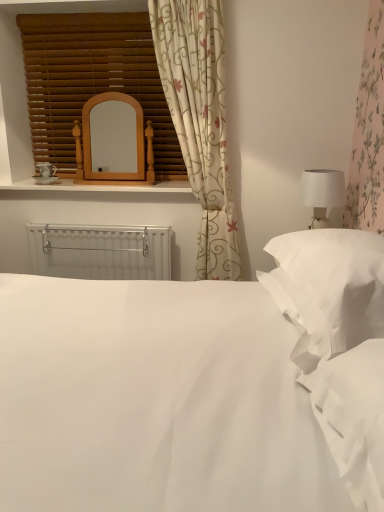
Question: Could you tell me if white soft pillow at right is turned towards white matte table lamp at right?

Choices:
 (A) no
 (B) yes

Answer: (A)

Question: Does white soft pillow at right contain white matte table lamp at right?

Choices:
 (A) yes
 (B) no

Answer: (B)

Question: Is white soft pillow at right thinner than white matte table lamp at right?

Choices:
 (A) yes
 (B) no

Answer: (B)

Question: Can you confirm if white soft pillow at right is shorter than white matte table lamp at right?

Choices:
 (A) yes
 (B) no

Answer: (A)

Question: From the image's perspective, does white soft pillow at right appear higher than white matte table lamp at right?

Choices:
 (A) no
 (B) yes

Answer: (A)

Question: Can you confirm if white soft pillow at right is positioned to the left of white matte table lamp at right?

Choices:
 (A) yes
 (B) no

Answer: (A)

Question: Is wooden mirror at upper center positioned beyond the bounds of floral fabric curtain at upper center?

Choices:
 (A) yes
 (B) no

Answer: (A)

Question: From the image's perspective, does wooden mirror at upper center appear lower than floral fabric curtain at upper center?

Choices:
 (A) yes
 (B) no

Answer: (B)

Question: From a real-world perspective, is wooden mirror at upper center on floral fabric curtain at upper center?

Choices:
 (A) no
 (B) yes

Answer: (B)

Question: Is wooden mirror at upper center wider than floral fabric curtain at upper center?

Choices:
 (A) yes
 (B) no

Answer: (B)

Question: Considering the relative sizes of wooden mirror at upper center and floral fabric curtain at upper center in the image provided, is wooden mirror at upper center bigger than floral fabric curtain at upper center?

Choices:
 (A) yes
 (B) no

Answer: (B)

Question: Is wooden mirror at upper center to the left of floral fabric curtain at upper center from the viewer's perspective?

Choices:
 (A) no
 (B) yes

Answer: (B)

Question: Is white plastic radiator at center aimed at white soft pillow at right?

Choices:
 (A) yes
 (B) no

Answer: (B)